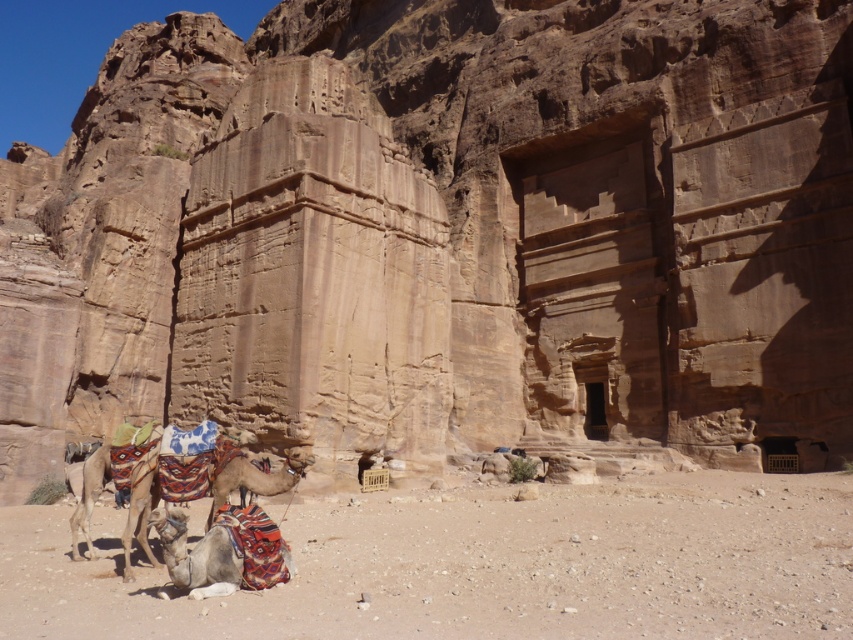
Question: Does multicolored fabric camel at lower left have a smaller size compared to brown textured camel at center?

Choices:
 (A) yes
 (B) no

Answer: (B)

Question: Which point is farther to the camera?

Choices:
 (A) multicolored fabric camel at lower center
 (B) desert sand at lower left
 (C) multicolored fabric camel at lower left
 (D) brown textured camel at center

Answer: (D)

Question: Which object appears farthest from the camera in this image?

Choices:
 (A) brown textured camel at center
 (B) desert sand at lower left
 (C) multicolored fabric camel at lower left

Answer: (A)

Question: Which point is closer to the camera?

Choices:
 (A) (328, 556)
 (B) (241, 454)
 (C) (245, 528)

Answer: (C)

Question: Where is desert sand at lower left located in relation to brown textured camel at center in the image?

Choices:
 (A) above
 (B) below

Answer: (B)

Question: Is desert sand at lower left positioned behind multicolored fabric camel at lower center?

Choices:
 (A) no
 (B) yes

Answer: (A)